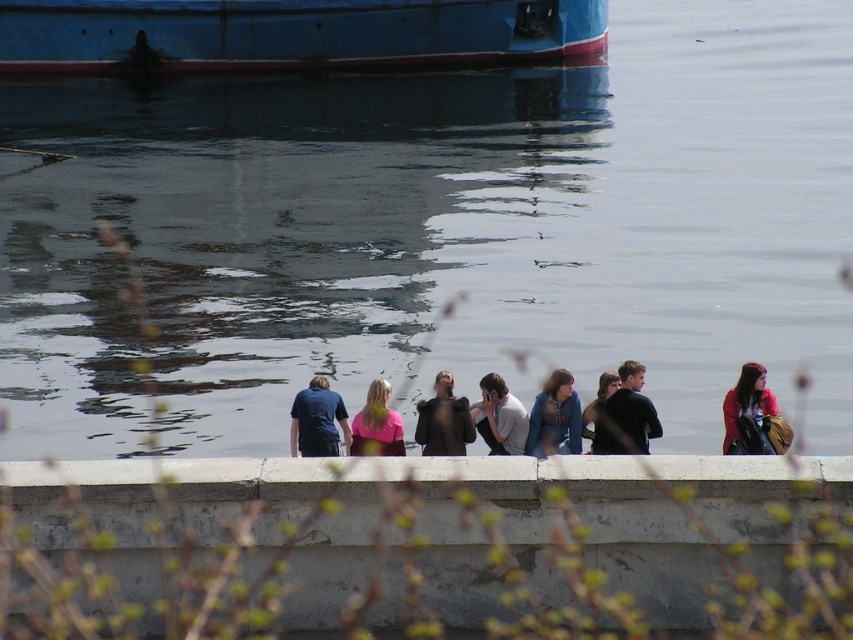
Question: Does dark blue shirt at center have a greater width compared to light gray fabric shirt at center?

Choices:
 (A) yes
 (B) no

Answer: (A)

Question: Which point is closer to the camera?

Choices:
 (A) blue painted wood boat at upper left
 (B) dark blue fabric shirt at center
 (C) concrete ledge at lower center

Answer: (C)

Question: Based on their relative distances, which object is nearer to the concrete ledge at lower center?

Choices:
 (A) pink matte shirt at center
 (B) blue painted wood boat at upper left

Answer: (A)

Question: Is light gray fabric shirt at center to the right of dark brown leather jacket at center from the viewer's perspective?

Choices:
 (A) no
 (B) yes

Answer: (A)

Question: Can you confirm if blue painted wood boat at upper left is positioned to the right of matte pink shirt at lower right?

Choices:
 (A) yes
 (B) no

Answer: (B)

Question: Which of the following is the farthest from the observer?

Choices:
 (A) (305, 422)
 (B) (761, 406)
 (C) (398, 429)
 (D) (514, 436)

Answer: (A)